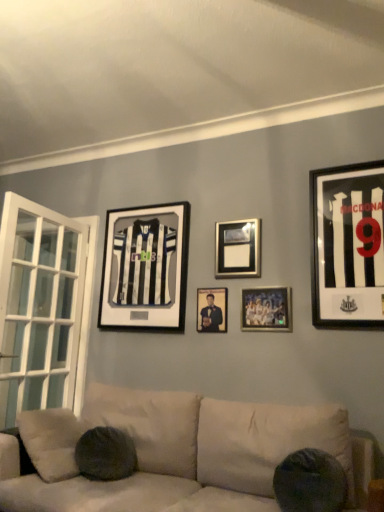
Question: Is black matte jersey at right, the 5th picture frame in the left-to-right sequence, outside of black and white jersey at upper center, placed as the 1th picture frame when sorted from left to right?

Choices:
 (A) no
 (B) yes

Answer: (B)

Question: Is black matte jersey at right, the 5th picture frame in the left-to-right sequence, in front of black and white jersey at upper center, placed as the 1th picture frame when sorted from left to right?

Choices:
 (A) no
 (B) yes

Answer: (B)

Question: From a real-world perspective, is black matte jersey at right, the 5th picture frame in the left-to-right sequence, located beneath black and white jersey at upper center, placed as the 1th picture frame when sorted from left to right?

Choices:
 (A) yes
 (B) no

Answer: (B)

Question: Considering the relative sizes of black matte jersey at right, the 5th picture frame in the left-to-right sequence, and black and white jersey at upper center, acting as the 5th picture frame starting from the right, in the image provided, is black matte jersey at right, the 5th picture frame in the left-to-right sequence, thinner than black and white jersey at upper center, acting as the 5th picture frame starting from the right,?

Choices:
 (A) no
 (B) yes

Answer: (A)

Question: From the image's perspective, does black matte jersey at right, the 5th picture frame in the left-to-right sequence, appear lower than black and white jersey at upper center, placed as the 1th picture frame when sorted from left to right?

Choices:
 (A) yes
 (B) no

Answer: (B)

Question: From a real-world perspective, is black and white jersey at upper center, acting as the 5th picture frame starting from the right, positioned above or below metallic silver picture frame at center, which ranks as the third picture frame in left-to-right order?

Choices:
 (A) above
 (B) below

Answer: (B)

Question: Based on their sizes in the image, would you say black and white jersey at upper center, acting as the 5th picture frame starting from the right, is bigger or smaller than metallic silver picture frame at center, acting as the 3th picture frame starting from the right?

Choices:
 (A) big
 (B) small

Answer: (A)

Question: Is black and white jersey at upper center, acting as the 5th picture frame starting from the right, situated inside metallic silver picture frame at center, acting as the 3th picture frame starting from the right, or outside?

Choices:
 (A) outside
 (B) inside

Answer: (A)

Question: From their relative heights in the image, would you say black and white jersey at upper center, placed as the 1th picture frame when sorted from left to right, is taller or shorter than metallic silver picture frame at center, acting as the 3th picture frame starting from the right?

Choices:
 (A) tall
 (B) short

Answer: (A)

Question: Considering the positions of black and white jersey at upper center, acting as the 5th picture frame starting from the right, and black matte jersey at right, the first picture frame from the right, in the image, is black and white jersey at upper center, acting as the 5th picture frame starting from the right, taller or shorter than black matte jersey at right, the first picture frame from the right,?

Choices:
 (A) short
 (B) tall

Answer: (A)

Question: Considering the positions of black and white jersey at upper center, acting as the 5th picture frame starting from the right, and black matte jersey at right, the first picture frame from the right, in the image, is black and white jersey at upper center, acting as the 5th picture frame starting from the right, wider or thinner than black matte jersey at right, the first picture frame from the right,?

Choices:
 (A) thin
 (B) wide

Answer: (A)

Question: From the image's perspective, is black and white jersey at upper center, placed as the 1th picture frame when sorted from left to right, positioned above or below black matte jersey at right, the 5th picture frame in the left-to-right sequence?

Choices:
 (A) above
 (B) below

Answer: (B)

Question: Looking at the image, does black and white jersey at upper center, acting as the 5th picture frame starting from the right, seem bigger or smaller compared to black matte jersey at right, the 5th picture frame in the left-to-right sequence?

Choices:
 (A) small
 (B) big

Answer: (B)

Question: Is metallic silver photo frame at center, positioned as the 2th picture frame in right-to-left order, taller or shorter than metallic silver picture frame at center, which ranks as the third picture frame in left-to-right order?

Choices:
 (A) tall
 (B) short

Answer: (B)

Question: Is metallic silver photo frame at center, positioned as the 2th picture frame in right-to-left order, inside or outside of metallic silver picture frame at center, acting as the 3th picture frame starting from the right?

Choices:
 (A) outside
 (B) inside

Answer: (A)